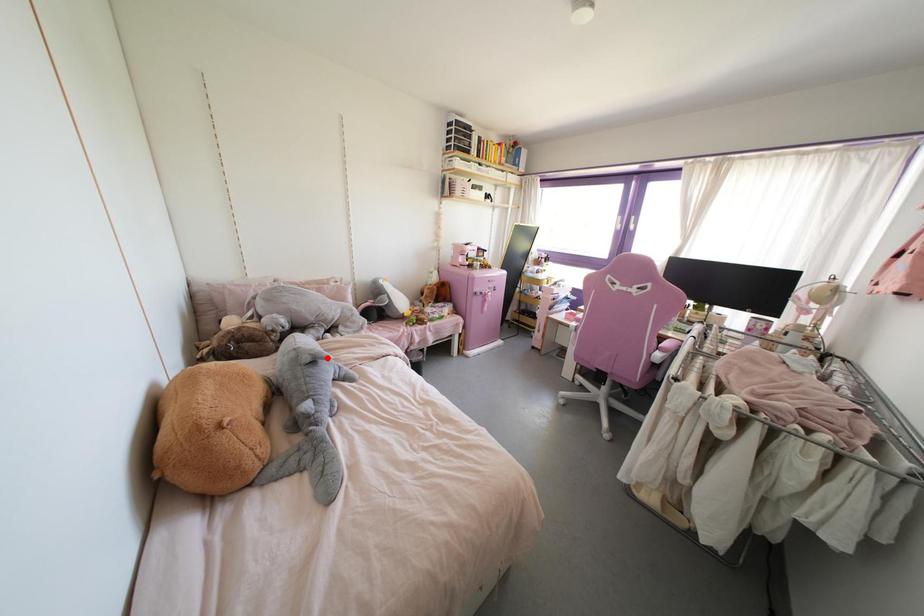
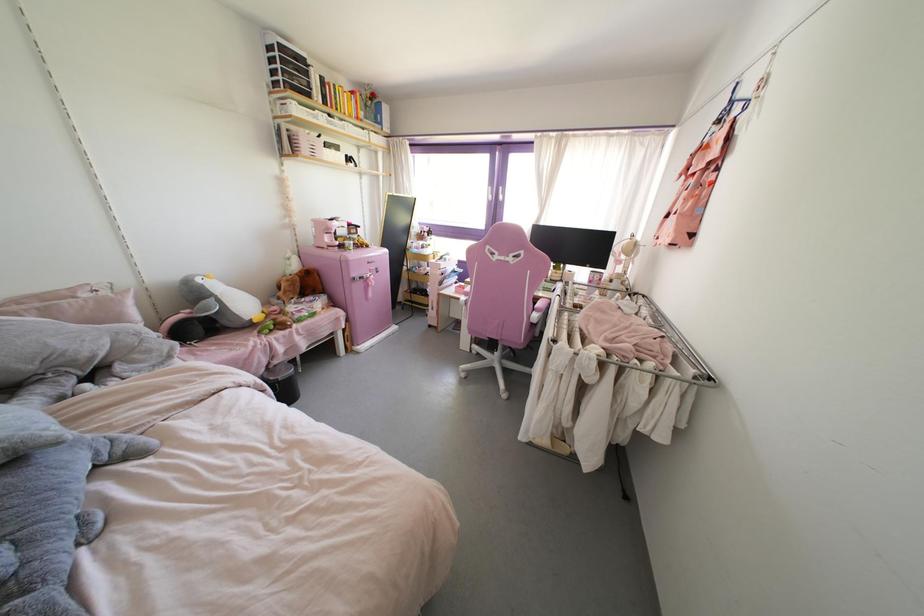
Where in the second image is the point corresponding to the highlighted location from the first image?

(57, 442)